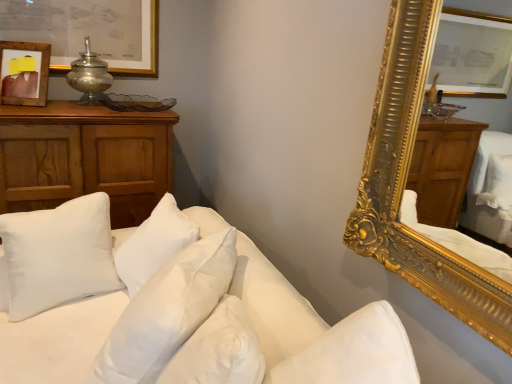
Question: Could white soft pillow at center, positioned as the 2th pillow in back-to-front order, be considered to be inside wooden cabinet at left?

Choices:
 (A) no
 (B) yes

Answer: (A)

Question: From a real-world perspective, is wooden cabinet at left located higher than white soft pillow at center, which is the first pillow from right to left?

Choices:
 (A) yes
 (B) no

Answer: (B)

Question: Is wooden cabinet at left positioned with its back to white soft pillow at center, positioned as the 2th pillow in back-to-front order?

Choices:
 (A) yes
 (B) no

Answer: (B)

Question: Is wooden cabinet at left taller than white soft pillow at center, the second pillow in the left-to-right sequence?

Choices:
 (A) yes
 (B) no

Answer: (A)

Question: Can you confirm if wooden cabinet at left is positioned to the left of white soft pillow at center, which is the first pillow from right to left?

Choices:
 (A) no
 (B) yes

Answer: (B)

Question: Is wooden picture frame at upper left wider or thinner than wooden cabinet at left?

Choices:
 (A) thin
 (B) wide

Answer: (A)

Question: Would you say wooden picture frame at upper left is to the left or to the right of wooden cabinet at left in the picture?

Choices:
 (A) right
 (B) left

Answer: (B)

Question: Considering the positions of point (24, 49) and point (156, 122), is point (24, 49) closer or farther from the camera than point (156, 122)?

Choices:
 (A) farther
 (B) closer

Answer: (B)

Question: Considering their positions, is wooden picture frame at upper left located in front of or behind wooden cabinet at left?

Choices:
 (A) behind
 (B) front

Answer: (A)

Question: Considering the positions of white soft pillows at lower left and white soft pillow at left, positioned as the 1th pillow in left-to-right order, in the image, is white soft pillows at lower left bigger or smaller than white soft pillow at left, positioned as the 1th pillow in left-to-right order,?

Choices:
 (A) small
 (B) big

Answer: (B)

Question: Relative to white soft pillow at left, the 1th pillow in the back-to-front sequence, is white soft pillows at lower left in front or behind?

Choices:
 (A) front
 (B) behind

Answer: (A)

Question: Looking at their shapes, would you say white soft pillows at lower left is wider or thinner than white soft pillow at left, positioned as the 1th pillow in left-to-right order?

Choices:
 (A) wide
 (B) thin

Answer: (A)

Question: From a real-world perspective, is white soft pillows at lower left above or below white soft pillow at left, the 1th pillow in the back-to-front sequence?

Choices:
 (A) above
 (B) below

Answer: (B)

Question: Visually, is metallic silver table lamp at upper left positioned to the left or to the right of white soft pillows at lower left?

Choices:
 (A) left
 (B) right

Answer: (A)

Question: In terms of size, does metallic silver table lamp at upper left appear bigger or smaller than white soft pillows at lower left?

Choices:
 (A) big
 (B) small

Answer: (B)